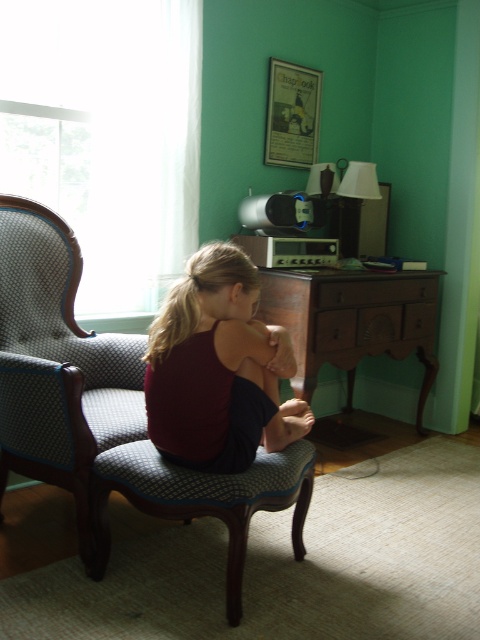
Question: Is brown wood dresser at center above blonde hair at upper center?

Choices:
 (A) yes
 (B) no

Answer: (B)

Question: Does brown wood dresser at center appear over patterned fabric stool at center?

Choices:
 (A) no
 (B) yes

Answer: (B)

Question: Is brown wood dresser at center bigger than patterned fabric stool at center?

Choices:
 (A) yes
 (B) no

Answer: (A)

Question: Which of the following is the closest to the observer?

Choices:
 (A) blonde hair at upper center
 (B) matte red tank top at center

Answer: (B)

Question: Which point is farther from the camera taking this photo?

Choices:
 (A) (269, 292)
 (B) (184, 330)
 (C) (229, 616)

Answer: (A)

Question: Which point is farther to the camera?

Choices:
 (A) (191, 268)
 (B) (225, 380)
 (C) (215, 488)
 (D) (392, 332)

Answer: (D)